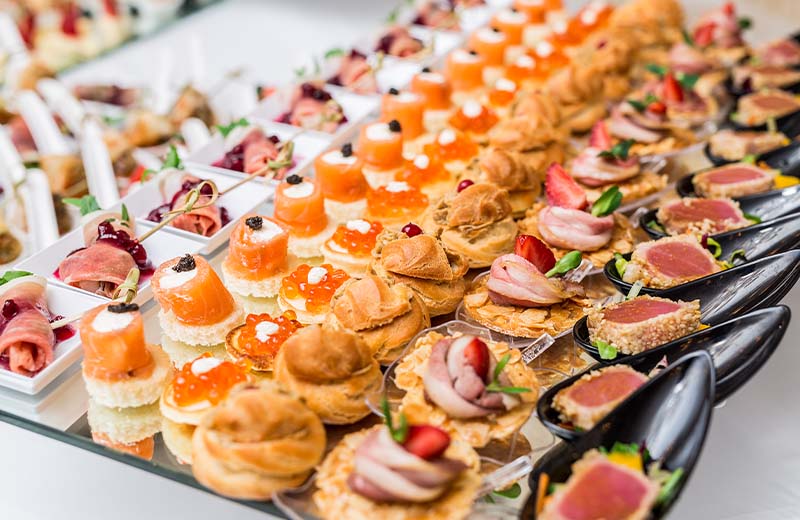
Where is `spoon`? The height and width of the screenshot is (520, 800). spoon is located at coordinates (689, 412).